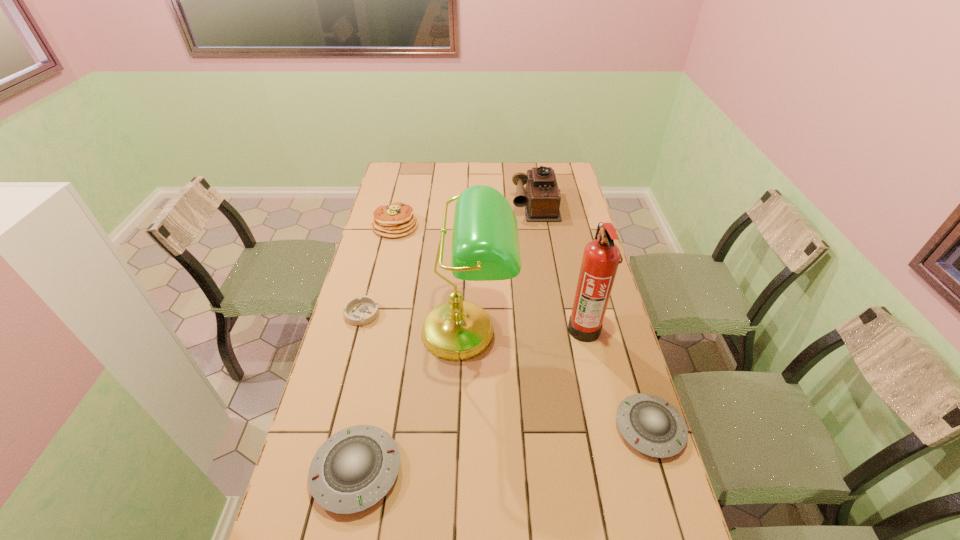
Locate an element on the screen. the taller saucer is located at coordinates (360, 463).

Locate an element on the screen. The width and height of the screenshot is (960, 540). the left saucer is located at coordinates (360, 463).

This screenshot has height=540, width=960. In order to click on the shorter saucer in this screenshot , I will do `click(653, 426)`.

Identify the location of the right saucer. This screenshot has width=960, height=540. (653, 426).

The image size is (960, 540). Identify the location of the third tallest object. (541, 198).

What are the coordinates of `the fourth shortest object` in the screenshot? It's located at (394, 220).

Find the location of `lamp`. lamp is located at coordinates 485,244.

In order to click on the shortest object in this screenshot , I will do 358,311.

Identify the location of fire extinguisher. (601, 257).

Locate an element on the screen. vacant space situated on the back of the taller saucer is located at coordinates (374, 386).